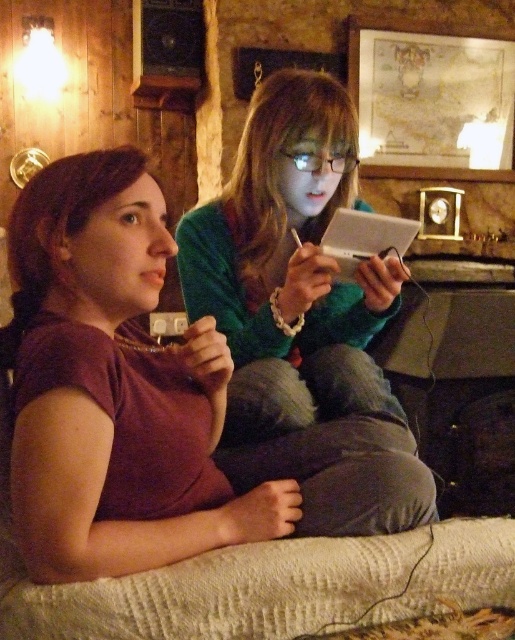
You are a tailor measuring two customers for custom shirts. You see the matte purple shirt at center and the green matte sweater at center. Which garment should you adjust to ensure it fits the taller customer?

The green matte sweater at center is taller than the matte purple shirt at center, so you should adjust the green matte sweater at center to fit the taller customer.